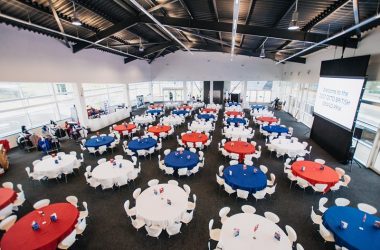
Identify the location of lighting. This screenshot has width=380, height=250. (75, 23), (141, 48), (293, 23), (263, 55).